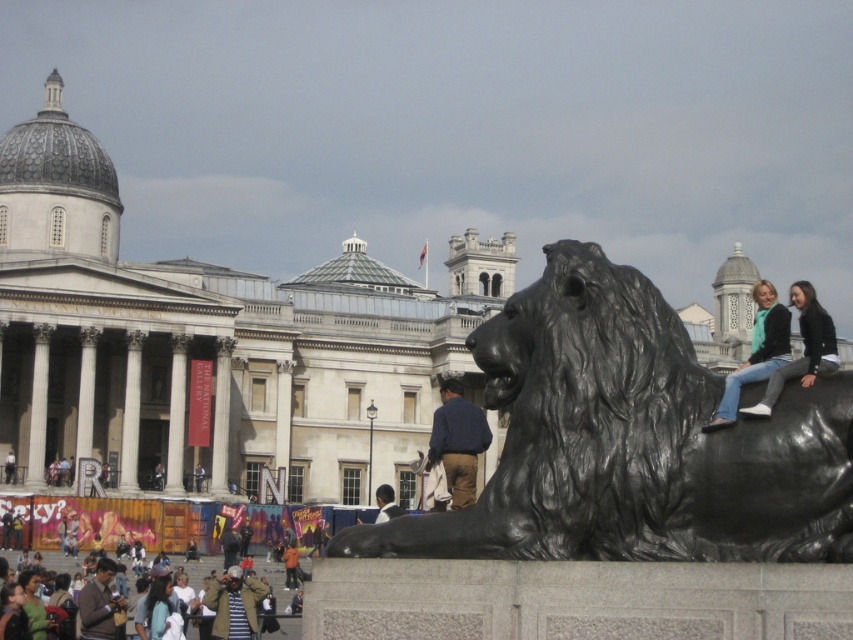
Does point (759, 316) lie behind point (282, 554)?

No.

What do you see at coordinates (756, 353) in the screenshot? I see `jeans at right` at bounding box center [756, 353].

This screenshot has width=853, height=640. Identify the location of jeans at right. (756, 353).

The height and width of the screenshot is (640, 853). I want to click on blue cotton shirt at center, so click(457, 442).

Find the location of a particular element. The height and width of the screenshot is (640, 853). blue cotton shirt at center is located at coordinates (457, 442).

Based on the photo, is brown sweater at lower left positioned at the back of dark blue jeans at lower center?

That is False.

From the picture: Which of these two, brown sweater at lower left or dark blue jeans at lower center, stands shorter?

With less height is dark blue jeans at lower center.

Which is behind, point (102, 605) or point (15, 456)?

The point (15, 456) is behind.

Identify the location of brown sweater at lower left. (97, 604).